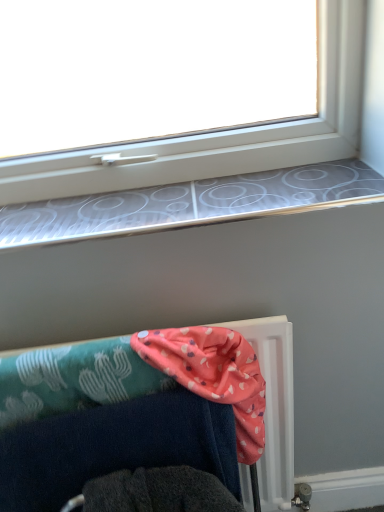
Where is `free space above silver metallic window sill at upper center (from a real-world perspective)`? free space above silver metallic window sill at upper center (from a real-world perspective) is located at coordinates (170, 203).